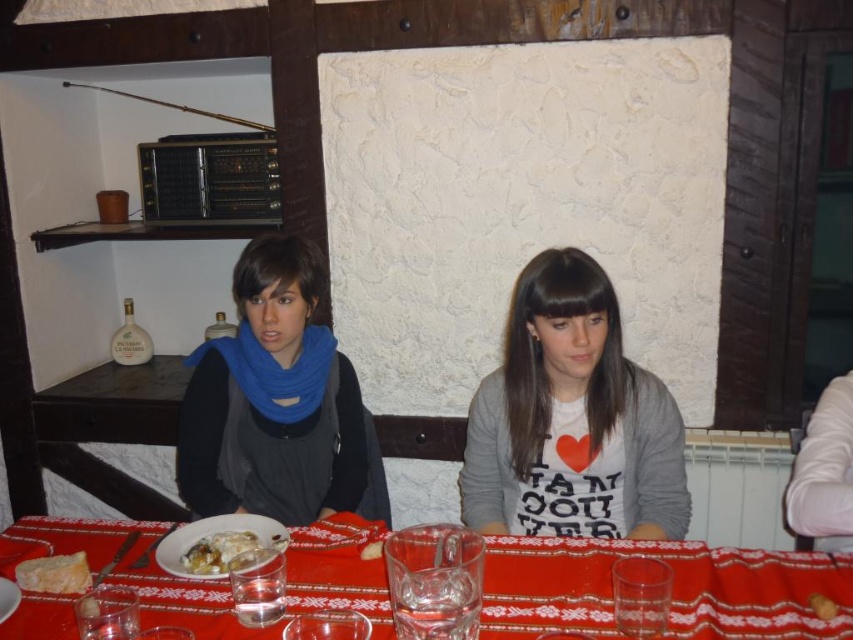
Question: Observing the image, what is the correct spatial positioning of blue scarf at center in reference to white creamy food at center?

Choices:
 (A) above
 (B) below

Answer: (A)

Question: Which point is farther to the camera?

Choices:
 (A) white glossy plate at center
 (B) blue scarf at center

Answer: (B)

Question: Based on their relative distances, which object is nearer to the red fabric tablecloth at center?

Choices:
 (A) white crumbly cheese at lower left
 (B) white creamy food at center
 (C) blue scarf at center

Answer: (B)

Question: Does red fabric tablecloth at center have a lesser width compared to white crumbly cheese at lower left?

Choices:
 (A) yes
 (B) no

Answer: (B)

Question: Which is farther from the white matte shirt at center?

Choices:
 (A) blue scarf at center
 (B) white glossy plate at center
 (C) white crumbly cheese at lower left
 (D) white creamy food at center

Answer: (C)

Question: Does red fabric tablecloth at center appear on the right side of white glossy plate at center?

Choices:
 (A) no
 (B) yes

Answer: (B)